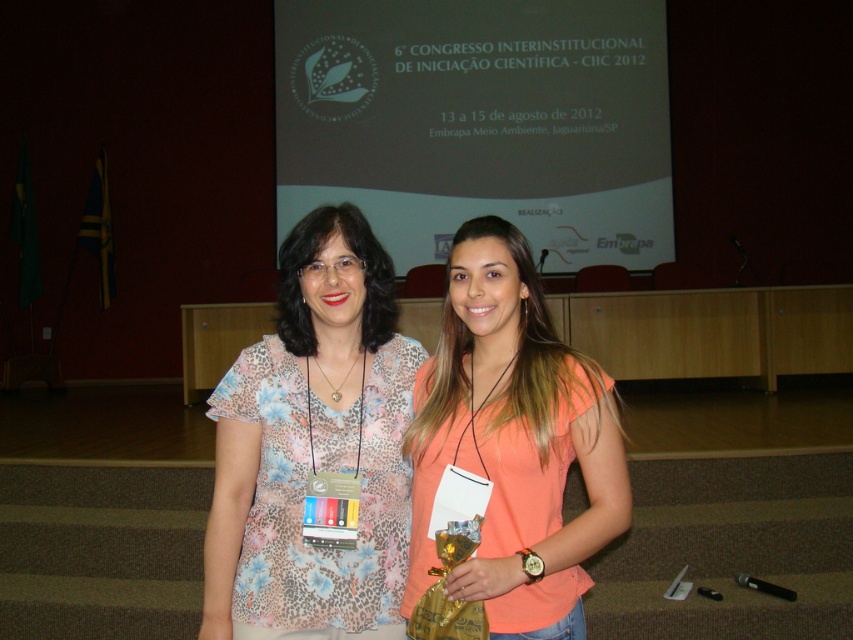
You are a photographer at the CIIC 2012 event and need to capture a photo of the two individuals wearing the floral print blouse at center and the orange matte shirt at center. To ensure both are in focus, you want to know which clothing item is taller. Which one is taller?

The floral print blouse at center is taller than the orange matte shirt at center.

You are a photographer at the conference and want to take a photo of the attendee wearing the floral print blouse at center without the matte white projector screen at upper center appearing in the background. Is this possible?

The floral print blouse at center is behind the matte white projector screen at upper center, so it is possible to take a photo of the attendee wearing the floral print blouse at center without the matte white projector screen at upper center in the background by adjusting the camera angle to exclude the screen.

You are standing in the conference hall and want to take a photo of the matte white projector screen at upper center. The camera you have requires you to be at least 5 meters away from the subject to avoid distortion. Is the current distance sufficient?

The matte white projector screen at upper center is 7.64 meters from the viewer, which is more than the required 5 meters, so the distance is sufficient to avoid distortion.